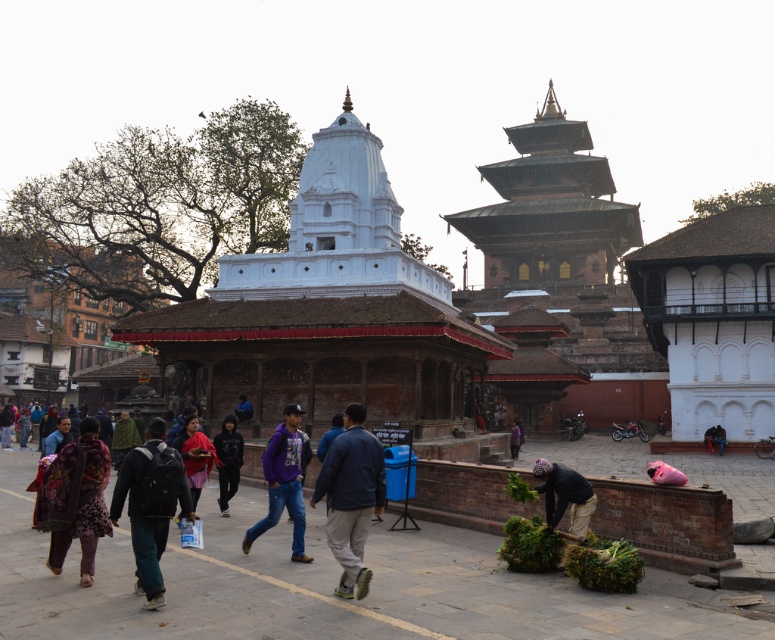
In the scene shown: Between dark brown fabric at lower right and black cotton hoodie at center, which one appears on the right side from the viewer's perspective?

From the viewer's perspective, dark brown fabric at lower right appears more on the right side.

This screenshot has width=775, height=640. What do you see at coordinates (567, 497) in the screenshot?
I see `dark brown fabric at lower right` at bounding box center [567, 497].

Is point (577, 490) closer to viewer compared to point (240, 458)?

Yes, it is.

The image size is (775, 640). I want to click on dark brown fabric at lower right, so click(567, 497).

Can you confirm if blue denim jacket at center is shorter than dark green backpack at center?

In fact, blue denim jacket at center may be taller than dark green backpack at center.

Who is more distant from viewer, (360, 474) or (145, 608)?

The point (360, 474) is more distant.

Find the location of a particular element. blue denim jacket at center is located at coordinates (350, 497).

Is blue denim jacket at center taller than purple fleece jacket at center?

Indeed, blue denim jacket at center has a greater height compared to purple fleece jacket at center.

The height and width of the screenshot is (640, 775). What do you see at coordinates (350, 497) in the screenshot? I see `blue denim jacket at center` at bounding box center [350, 497].

At what (x,y) coordinates should I click in order to perform the action: click on blue denim jacket at center. Please return your answer as a coordinate pair (x, y). Looking at the image, I should click on (350, 497).